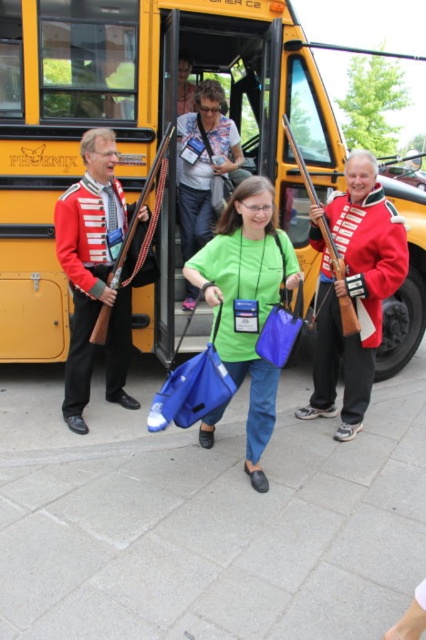
Which is more to the left, red wool coat at right or shiny red uniform at left?

shiny red uniform at left

Which is below, red wool coat at right or shiny red uniform at left?

red wool coat at right is below.

Is point (371, 189) positioned behind point (94, 218)?

No.

You are a GUI agent. You are given a task and a screenshot of the screen. Output one action in this format:
    pyautogui.click(x=<x>, y=<y>)
    Task: Click on the red wool coat at right
    The height and width of the screenshot is (640, 426).
    Given the screenshot: What is the action you would take?
    pyautogui.click(x=354, y=291)

Based on the photo, can you confirm if red wool coat at right is positioned to the right of green matte shirt at center?

Yes, red wool coat at right is to the right of green matte shirt at center.

Does point (350, 211) lie behind point (236, 305)?

Yes.

Locate an element on the screen. red wool coat at right is located at coordinates (354, 291).

Who is positioned more to the left, red wool coat at right or denim jacket at center?

denim jacket at center

Does red wool coat at right have a greater height compared to denim jacket at center?

Indeed, red wool coat at right has a greater height compared to denim jacket at center.

Image resolution: width=426 pixels, height=640 pixels. Identify the location of red wool coat at right. (354, 291).